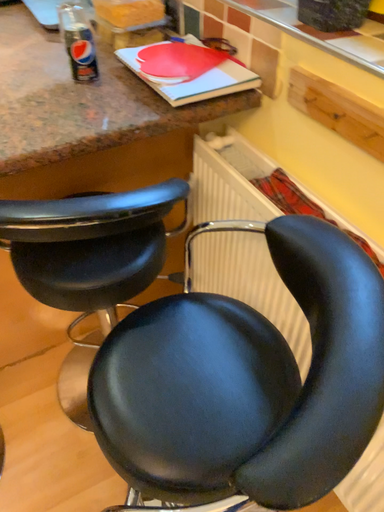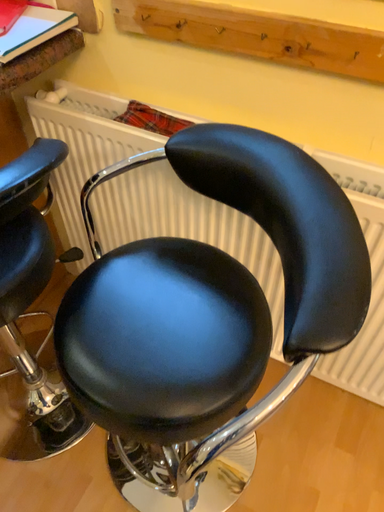
Question: Which way did the camera rotate in the video?

Choices:
 (A) rotated right
 (B) rotated left

Answer: (A)